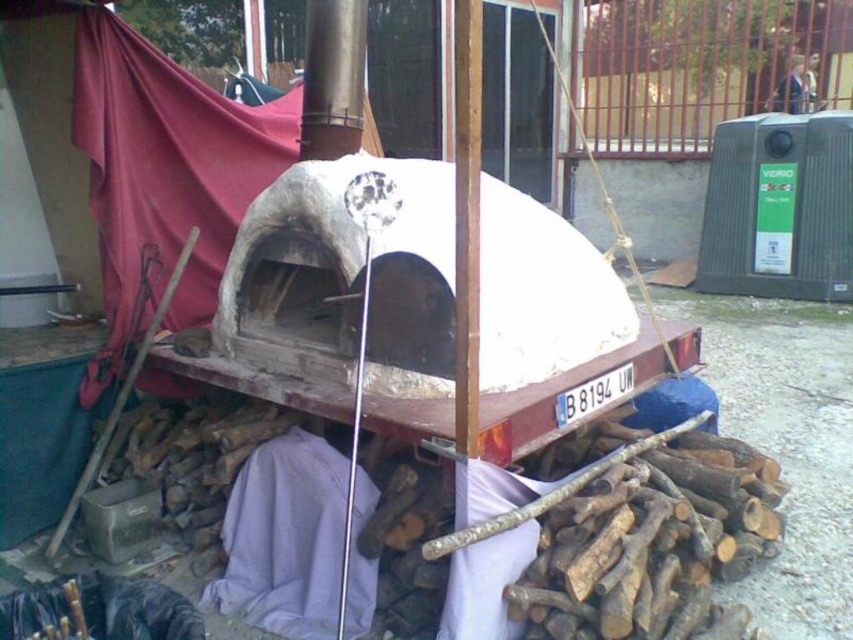
Question: Considering the relative positions of purple fabric at center and blue denim jacket at upper right in the image provided, where is purple fabric at center located with respect to blue denim jacket at upper right?

Choices:
 (A) above
 (B) below

Answer: (B)

Question: Is purple fabric at center to the left of blue denim jacket at upper right from the viewer's perspective?

Choices:
 (A) no
 (B) yes

Answer: (B)

Question: Which point appears closest to the camera in this image?

Choices:
 (A) (335, 548)
 (B) (780, 84)

Answer: (A)

Question: Is purple fabric at center positioned at the back of blue denim jacket at upper right?

Choices:
 (A) no
 (B) yes

Answer: (A)

Question: Which of the following is the closest to the observer?

Choices:
 (A) (254, 492)
 (B) (798, 83)

Answer: (A)